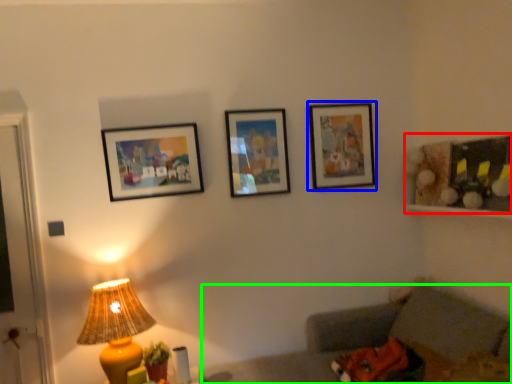
Question: Which object is the closest to the decorative picture (highlighted by a red box)? Choose among these: picture frame (highlighted by a blue box) or couch (highlighted by a green box).

Choices:
 (A) picture frame
 (B) couch

Answer: (A)